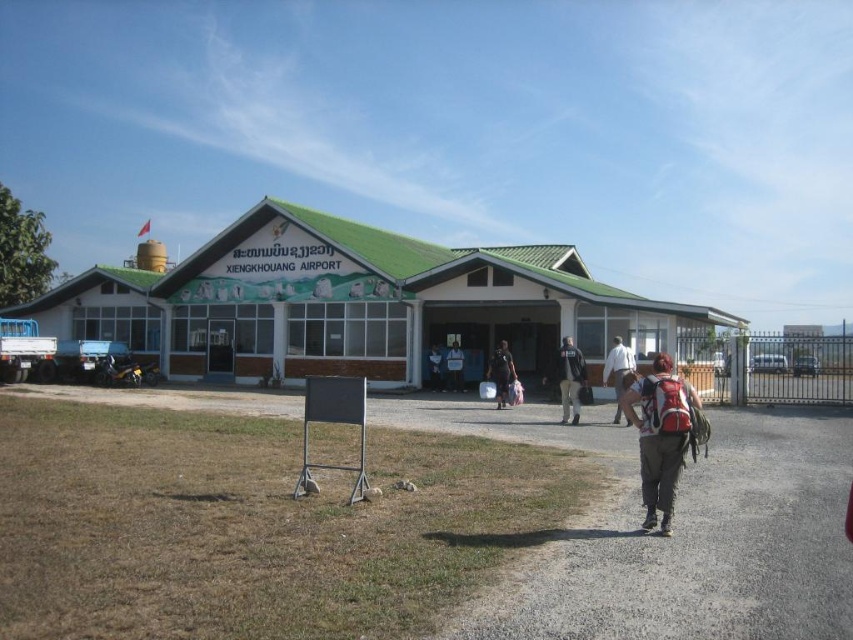
Does red backpack at lower right come behind light brown leather pants at center?

No, it is not.

Can you confirm if red backpack at lower right is positioned above light brown leather pants at center?

Yes.

This screenshot has height=640, width=853. What do you see at coordinates (660, 435) in the screenshot?
I see `red backpack at lower right` at bounding box center [660, 435].

Where is `red backpack at lower right`? Image resolution: width=853 pixels, height=640 pixels. red backpack at lower right is located at coordinates (660, 435).

From the picture: Can you confirm if light brown leather pants at center is positioned to the right of dark blue shirt at center?

Indeed, light brown leather pants at center is positioned on the right side of dark blue shirt at center.

Is light brown leather pants at center above dark blue shirt at center?

Yes, light brown leather pants at center is above dark blue shirt at center.

Is point (624, 371) farther from viewer compared to point (431, 356)?

That is False.

Where is `light brown leather pants at center`? light brown leather pants at center is located at coordinates (618, 371).

Is red backpack at lower right closer to camera compared to black fabric backpack at center?

Yes, it is.

Does red backpack at lower right have a lesser height compared to black fabric backpack at center?

Correct, red backpack at lower right is not as tall as black fabric backpack at center.

Which is behind, point (630, 397) or point (570, 384)?

The point (570, 384) is more distant.

Identify the location of red backpack at lower right. This screenshot has height=640, width=853. (660, 435).